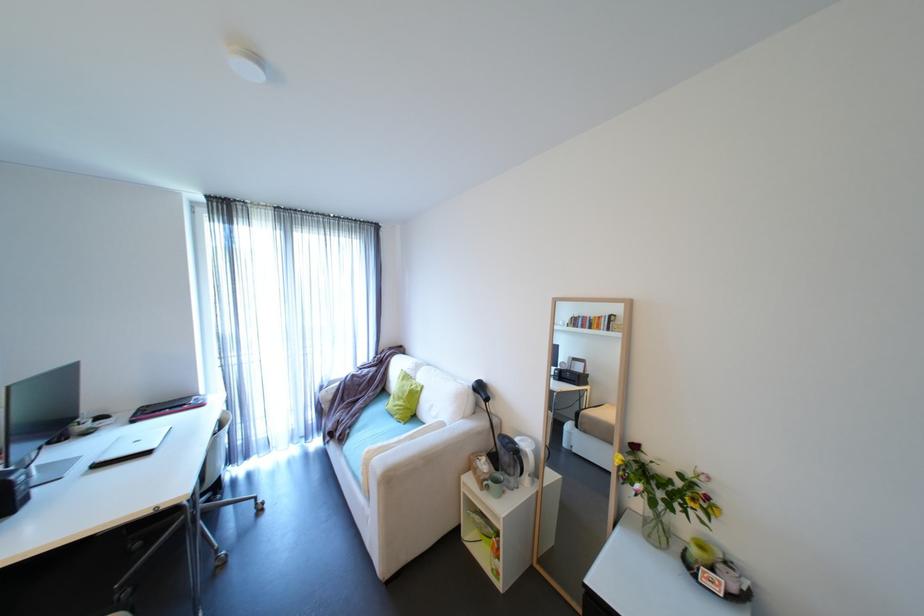
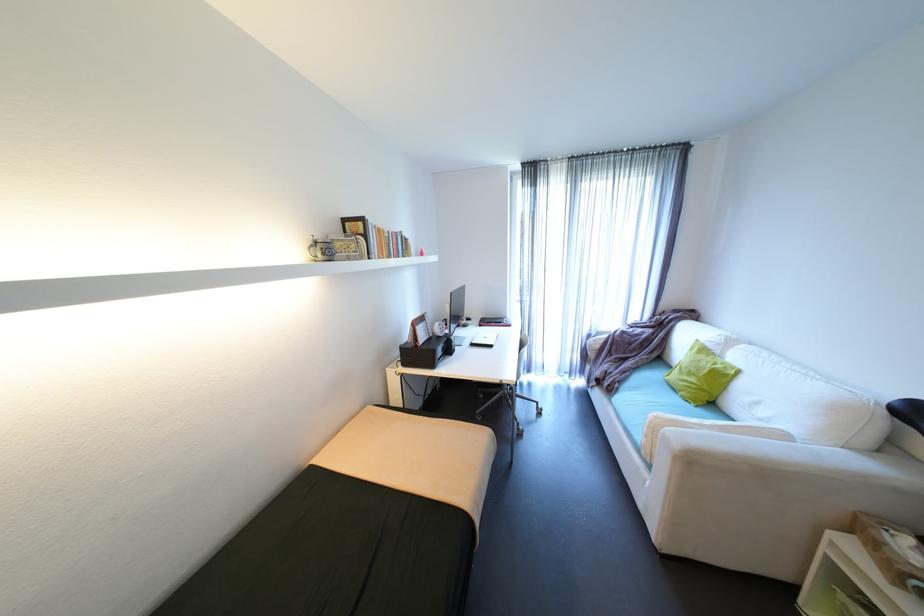
The point at (360, 419) is marked in the first image. Where is the corresponding point in the second image?

(630, 377)